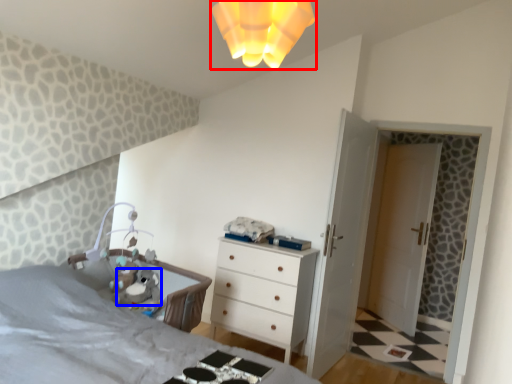
Question: Which object appears closest to the camera in this image, light fixture (highlighted by a red box) or animal (highlighted by a blue box)?

Choices:
 (A) light fixture
 (B) animal

Answer: (A)